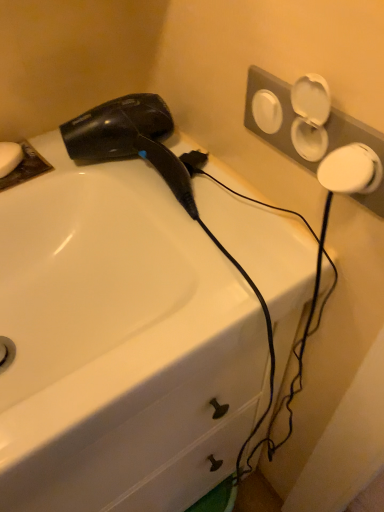
Question: From the image's perspective, is white matte soap at upper left beneath black glossy hair dryer at upper left?

Choices:
 (A) no
 (B) yes

Answer: (A)

Question: Is black glossy hair dryer at upper left a part of white matte soap at upper left?

Choices:
 (A) no
 (B) yes

Answer: (A)

Question: Considering the relative sizes of white matte soap at upper left and black glossy hair dryer at upper left in the image provided, is white matte soap at upper left taller than black glossy hair dryer at upper left?

Choices:
 (A) no
 (B) yes

Answer: (A)

Question: Is white matte soap at upper left positioned behind black glossy hair dryer at upper left?

Choices:
 (A) yes
 (B) no

Answer: (A)

Question: Would you say white matte soap at upper left is a long distance from black glossy hair dryer at upper left?

Choices:
 (A) yes
 (B) no

Answer: (B)

Question: Can you confirm if white matte soap at upper left is shorter than black glossy hair dryer at upper left?

Choices:
 (A) yes
 (B) no

Answer: (A)

Question: Is the surface of white glossy sink at upper left in direct contact with white matte soap at upper left?

Choices:
 (A) no
 (B) yes

Answer: (A)

Question: Is white glossy sink at upper left shorter than white matte soap at upper left?

Choices:
 (A) no
 (B) yes

Answer: (A)

Question: Is white matte soap at upper left surrounded by white glossy sink at upper left?

Choices:
 (A) yes
 (B) no

Answer: (A)

Question: Can you confirm if white glossy sink at upper left is taller than white matte soap at upper left?

Choices:
 (A) yes
 (B) no

Answer: (A)

Question: Is white glossy sink at upper left at the right side of white matte soap at upper left?

Choices:
 (A) yes
 (B) no

Answer: (A)

Question: Can you confirm if white glossy sink at upper left is wider than white matte soap at upper left?

Choices:
 (A) yes
 (B) no

Answer: (A)

Question: Is black glossy hair dryer at upper left aimed at white matte soap at upper left?

Choices:
 (A) no
 (B) yes

Answer: (A)